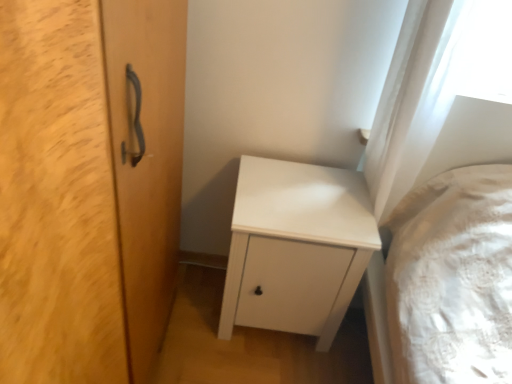
Locate an element on the screen. The height and width of the screenshot is (384, 512). white matte nightstand at center is located at coordinates (296, 247).

Image resolution: width=512 pixels, height=384 pixels. What do you see at coordinates (296, 247) in the screenshot?
I see `white matte nightstand at center` at bounding box center [296, 247].

Where is `white matte nightstand at center`? The image size is (512, 384). white matte nightstand at center is located at coordinates (296, 247).